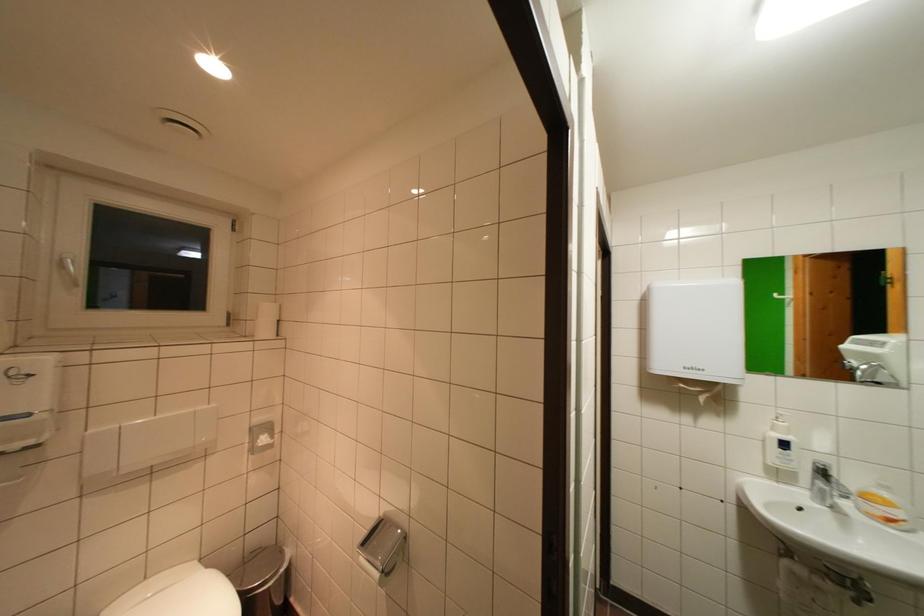
Find the location of a particular element. The height and width of the screenshot is (616, 924). white door handle is located at coordinates (783, 297).